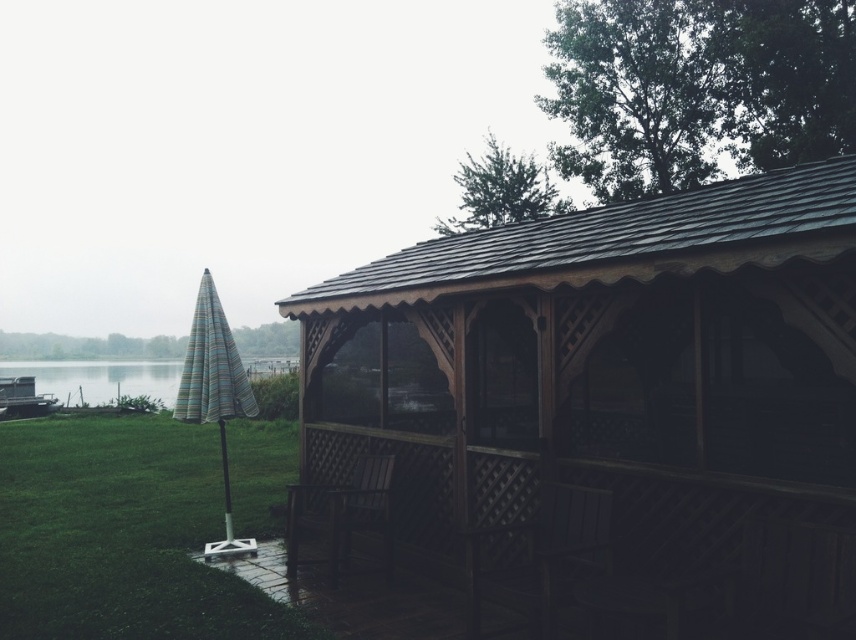
Is point (241, 360) positioned before point (372, 525)?

No, (241, 360) is further to viewer.

Identify the location of striped fabric umbrella at left. (214, 392).

Between brown wooden picnic table at lower center and blue striped umbrella at left, which one is positioned lower?

Positioned lower is blue striped umbrella at left.

Between brown wooden picnic table at lower center and blue striped umbrella at left, which one is positioned higher?

brown wooden picnic table at lower center is above.

Between point (349, 493) and point (152, 378), which one is positioned in front?

Point (349, 493)

Locate an element on the screen. The image size is (856, 640). brown wooden picnic table at lower center is located at coordinates point(343,513).

Does green grass at lower left have a greater width compared to striped fabric umbrella at left?

Indeed, green grass at lower left has a greater width compared to striped fabric umbrella at left.

Between point (134, 506) and point (205, 419), which one is positioned in front?

Point (205, 419) is more forward.

Find the location of `green grass at lower left`. green grass at lower left is located at coordinates (120, 536).